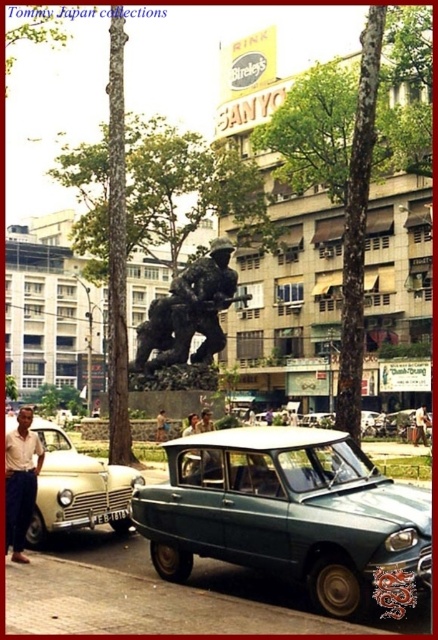
You are standing on the sidewalk in the urban scene and want to cross the street to reach the matte white car at left. The road is 12 meters wide. Can you safely cross without entering the road?

The matte white car at left is 19.26 meters away from you. Since the road is 12 meters wide, you would need to cross the road to reach it, but the question specifies not entering the road. Therefore, you cannot safely reach the matte white car at left without crossing the street.